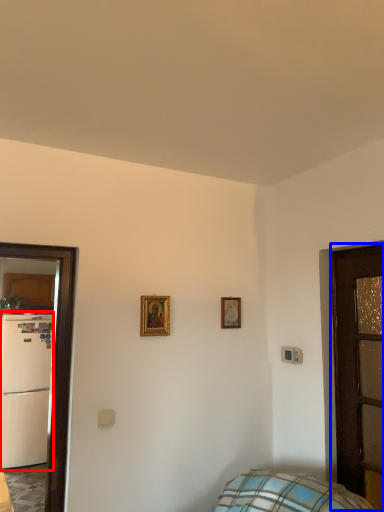
Question: Which object is further to the camera taking this photo, fridge (highlighted by a red box) or door (highlighted by a blue box)?

Choices:
 (A) fridge
 (B) door

Answer: (A)